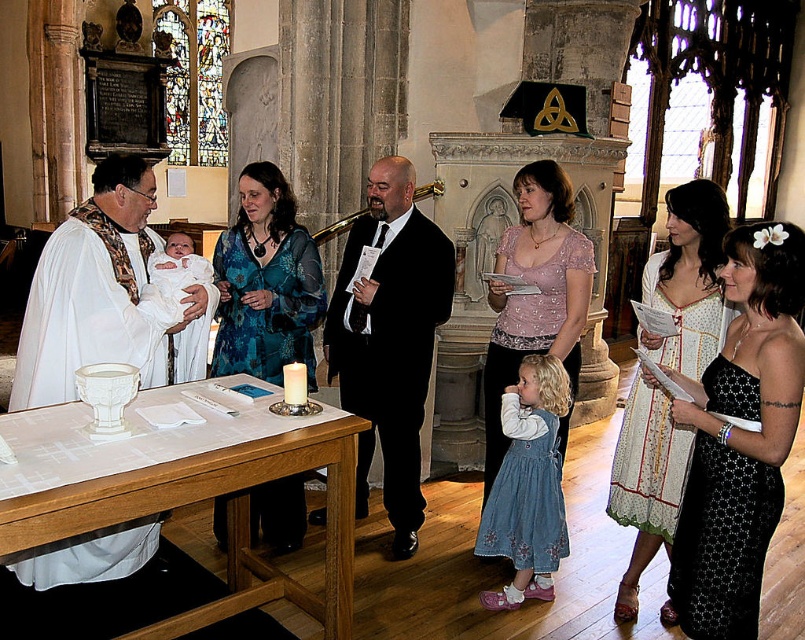
Question: Based on their relative distances, which object is nearer to the black satin dress at center?

Choices:
 (A) pale pink lace blouse at center
 (B) blue floral dress at center
 (C) white matte robe at left

Answer: (A)

Question: Is printed cotton dress at center positioned at the back of pale pink lace blouse at center?

Choices:
 (A) no
 (B) yes

Answer: (A)

Question: Is white matte robe at left bigger than denim dress at lower center?

Choices:
 (A) yes
 (B) no

Answer: (A)

Question: Among these objects, which one is nearest to the camera?

Choices:
 (A) black satin suit at center
 (B) white satin baby at center

Answer: (B)

Question: Which of the following is the farthest from the observer?

Choices:
 (A) printed cotton dress at center
 (B) blue floral dress at center
 (C) pale pink lace blouse at center

Answer: (B)

Question: Considering the relative positions of pale pink lace blouse at center and white satin baby at center in the image provided, where is pale pink lace blouse at center located with respect to white satin baby at center?

Choices:
 (A) left
 (B) right

Answer: (B)